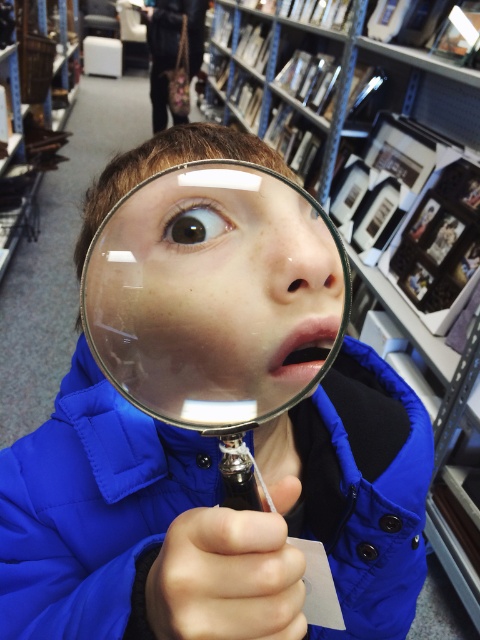
Is blue matte jacket at center above transparent glass magnifying glass at center?

Actually, blue matte jacket at center is below transparent glass magnifying glass at center.

What do you see at coordinates (132, 531) in the screenshot? Image resolution: width=480 pixels, height=640 pixels. I see `blue matte jacket at center` at bounding box center [132, 531].

Identify the location of blue matte jacket at center. (132, 531).

Does transparent glass magnifying glass at center appear over metallic silver bookshelf at upper center?

No.

Is transparent glass magnifying glass at center smaller than metallic silver bookshelf at upper center?

Yes, transparent glass magnifying glass at center is smaller than metallic silver bookshelf at upper center.

Who is more distant from viewer, (x=148, y=208) or (x=429, y=346)?

Point (x=429, y=346)

This screenshot has height=640, width=480. Find the location of `transparent glass magnifying glass at center`. transparent glass magnifying glass at center is located at coordinates (215, 294).

Does point (379, 349) come in front of point (199, 198)?

That is False.

Locate an element on the screen. Image resolution: width=480 pixels, height=640 pixels. metallic silver bookshelf at upper center is located at coordinates pos(402,321).